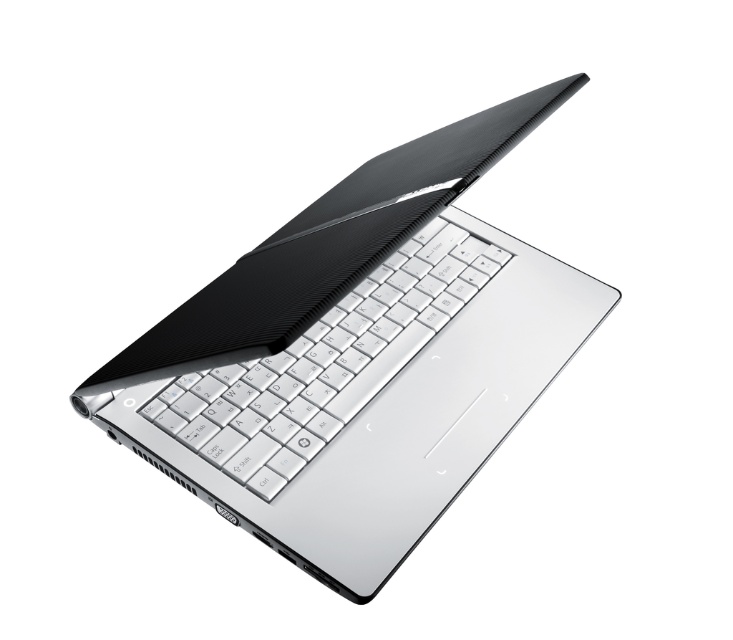
Question: Does silver metallic laptop at center appear over white matte keyboard at center?

Choices:
 (A) no
 (B) yes

Answer: (B)

Question: Does silver metallic laptop at center appear over white matte keyboard at center?

Choices:
 (A) yes
 (B) no

Answer: (A)

Question: Can you confirm if silver metallic laptop at center is positioned below white matte keyboard at center?

Choices:
 (A) no
 (B) yes

Answer: (A)

Question: Which point appears farthest from the camera in this image?

Choices:
 (A) (226, 392)
 (B) (199, 324)

Answer: (A)